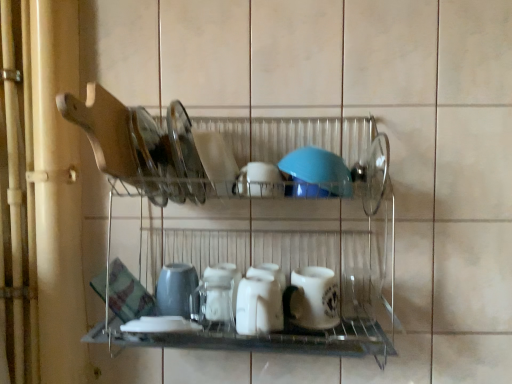
Question: In terms of size, does clear glass plate at upper center, positioned as the 6th tableware in right-to-left order, appear bigger or smaller than blue rubber lid at center, the 1th tableware positioned from the right?

Choices:
 (A) big
 (B) small

Answer: (A)

Question: From a real-world perspective, is clear glass plate at upper center, the 1th tableware viewed from the left, physically located above or below blue rubber lid at center, the 1th tableware positioned from the right?

Choices:
 (A) below
 (B) above

Answer: (B)

Question: Estimate the real-world distances between objects in this image. Which object is farther from the white glossy bowl at center, which ranks as the 3th tableware in right-to-left order?

Choices:
 (A) matte gray cup at center
 (B) white glossy bowl at center, the 2th tableware when ordered from left to right
 (C) clear glass dishes at upper center
 (D) clear glass plate at upper center, the 1th tableware viewed from the left
 (E) blue rubber lid at center, the 1th tableware positioned from the right

Answer: (A)

Question: Estimate the real-world distances between objects in this image. Which object is closer to the blue rubber lid at center, the 1th tableware positioned from the right?

Choices:
 (A) clear glass dishes at upper center
 (B) white matte mug at center, placed as the 2th tableware when sorted from right to left
 (C) matte gray cup at center
 (D) white glossy bowl at center, which is counted as the fifth tableware, starting from the right
 (E) clear glass plate at upper center, positioned as the 6th tableware in right-to-left order

Answer: (D)